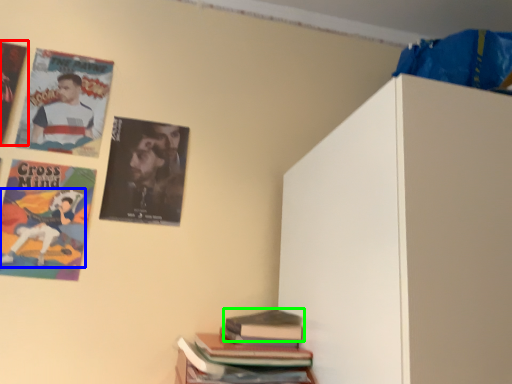
Question: Based on their relative distances, which object is farther from poster (highlighted by a red box)? Choose from person (highlighted by a blue box) and book (highlighted by a green box).

Choices:
 (A) person
 (B) book

Answer: (B)